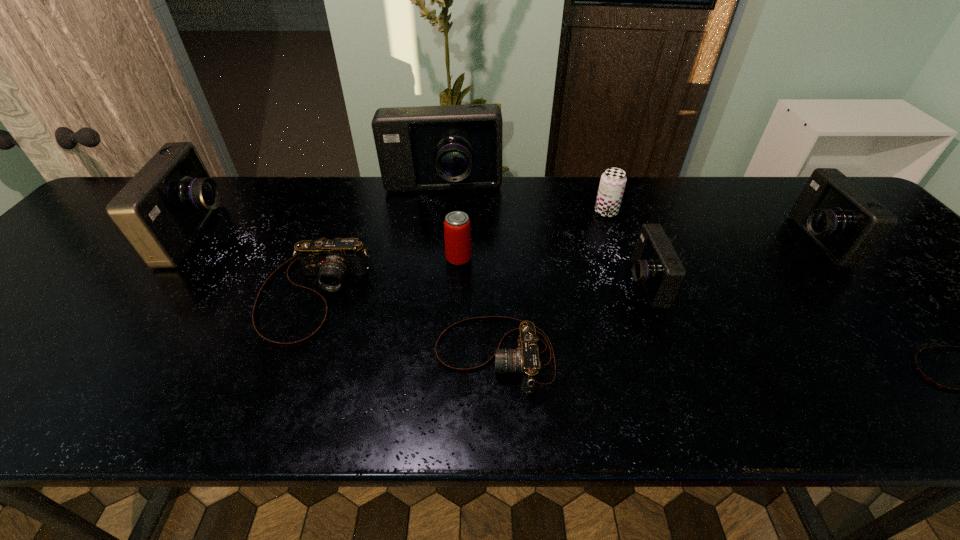
Locate an element on the screen. beer can that is at the far edge is located at coordinates (612, 184).

Locate an element on the screen. object that is at the near edge is located at coordinates (524, 360).

The height and width of the screenshot is (540, 960). Find the location of `object that is at the right edge`. object that is at the right edge is located at coordinates (845, 222).

In order to click on object present at the far right corner in this screenshot , I will do `click(845, 222)`.

In the image, there is a desktop. In order to click on vacant space at the far edge in this screenshot , I will do `click(326, 205)`.

Locate an element on the screen. The width and height of the screenshot is (960, 540). vacant region at the near edge of the desktop is located at coordinates (245, 386).

You are a GUI agent. You are given a task and a screenshot of the screen. Output one action in this format:
    pyautogui.click(x=<x>, y=<y>)
    Task: Click on the vacant region at the left edge of the desktop
    The height and width of the screenshot is (540, 960).
    Given the screenshot: What is the action you would take?
    pyautogui.click(x=111, y=247)

Identify the location of free space that is in between the smallest blue camera and the tallest object. (543, 237).

Image resolution: width=960 pixels, height=540 pixels. I want to click on free space between the farther beer can and the second shortest camera, so click(550, 284).

Identify the location of vacant area that lies between the leftmost camera and the fifth tallest camera. (256, 265).